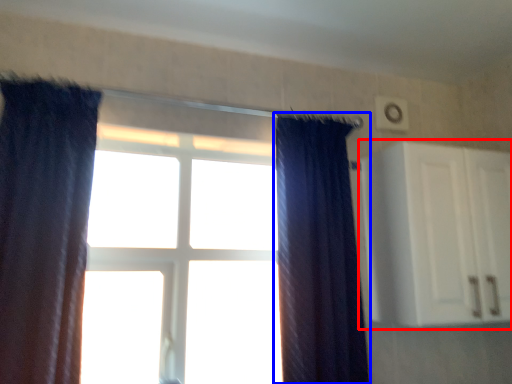
Question: Which of the following is the closest to the observer, cabinetry (highlighted by a red box) or curtain (highlighted by a blue box)?

Choices:
 (A) cabinetry
 (B) curtain

Answer: (B)